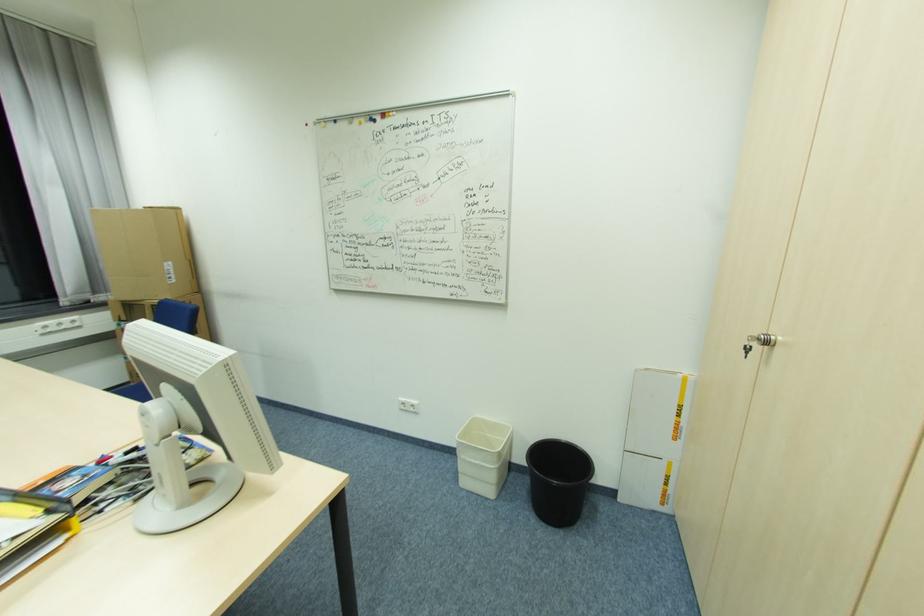
In order to click on black waste bin in this screenshot , I will do `click(557, 480)`.